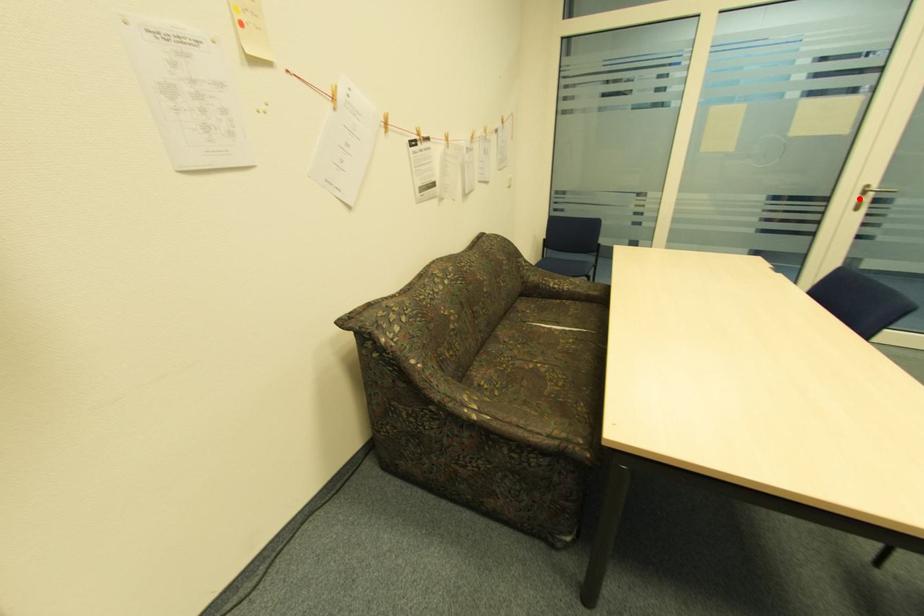
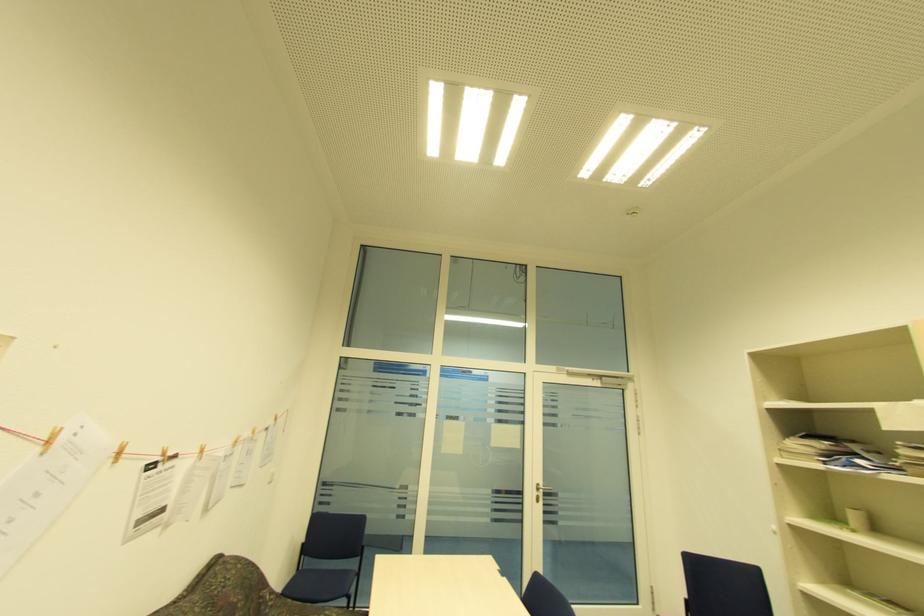
In the second image, find the point that corresponds to the highlighted location in the first image.

(538, 493)